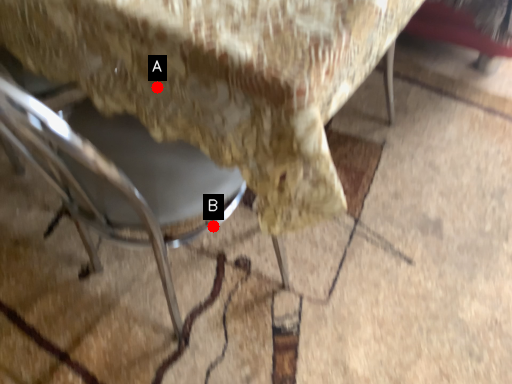
Question: Two points are circled on the image, labeled by A and B beside each circle. Which point is farther from the camera taking this photo?

Choices:
 (A) A is further
 (B) B is further

Answer: (B)